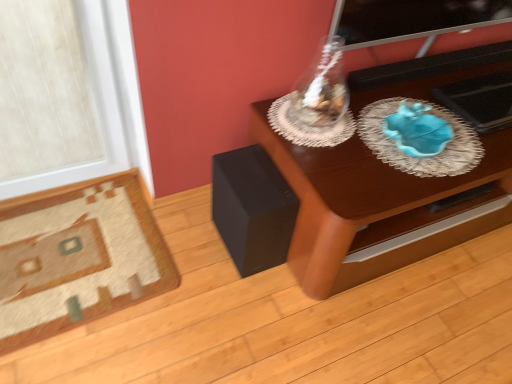
The height and width of the screenshot is (384, 512). What are the coordinates of `free point below carpeted rug at lower left (from a real-world perspective)` in the screenshot? It's located at (83, 267).